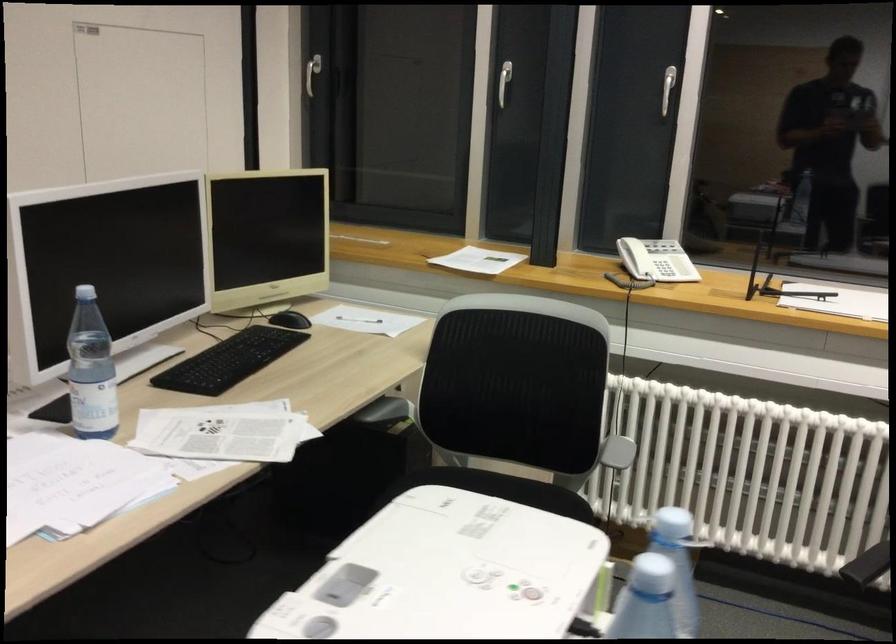
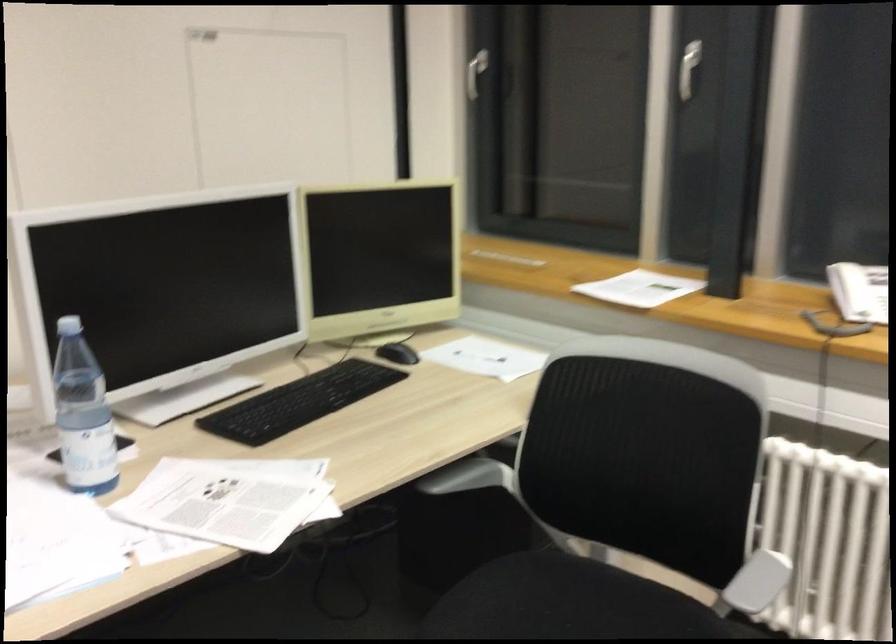
Locate, in the second image, the point that corresponds to (635,256) in the first image.

(850, 290)